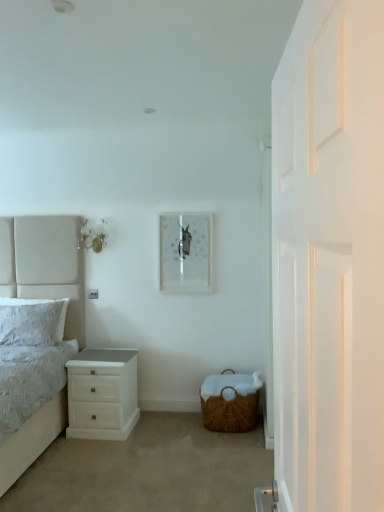
Question: Considering the relative sizes of white fabric bed at left and white textured pillow at left in the image provided, is white fabric bed at left thinner than white textured pillow at left?

Choices:
 (A) no
 (B) yes

Answer: (A)

Question: Is white fabric bed at left taller than white textured pillow at left?

Choices:
 (A) no
 (B) yes

Answer: (B)

Question: Considering the relative sizes of white fabric bed at left and white textured pillow at left in the image provided, is white fabric bed at left shorter than white textured pillow at left?

Choices:
 (A) yes
 (B) no

Answer: (B)

Question: Is white fabric bed at left not near white textured pillow at left?

Choices:
 (A) yes
 (B) no

Answer: (B)

Question: Does white fabric bed at left touch white textured pillow at left?

Choices:
 (A) yes
 (B) no

Answer: (B)

Question: From the image's perspective, is white fabric bed at left located above white textured pillow at left?

Choices:
 (A) no
 (B) yes

Answer: (A)

Question: From a real-world perspective, is white textured pillow at left on white wooden door at right?

Choices:
 (A) yes
 (B) no

Answer: (B)

Question: Is white textured pillow at left outside white wooden door at right?

Choices:
 (A) yes
 (B) no

Answer: (A)

Question: Is white textured pillow at left closer to camera compared to white wooden door at right?

Choices:
 (A) no
 (B) yes

Answer: (A)

Question: From the image's perspective, does white textured pillow at left appear higher than white wooden door at right?

Choices:
 (A) yes
 (B) no

Answer: (B)

Question: Could you tell me if white textured pillow at left is facing white wooden door at right?

Choices:
 (A) yes
 (B) no

Answer: (B)

Question: Does white textured pillow at left have a lesser height compared to white wooden door at right?

Choices:
 (A) yes
 (B) no

Answer: (A)

Question: From a real-world perspective, is woven brown basket at lower right positioned under matte white picture frame at center based on gravity?

Choices:
 (A) no
 (B) yes

Answer: (B)